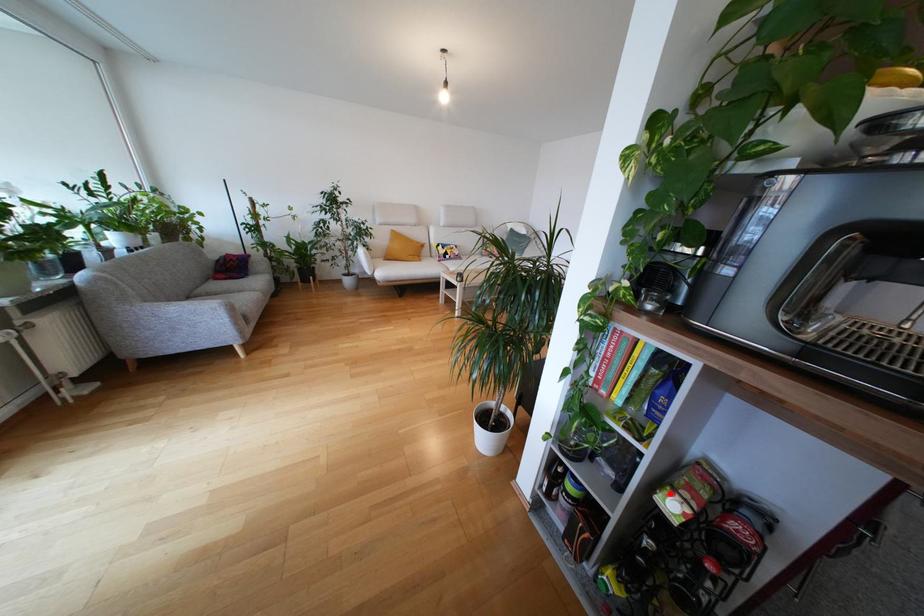
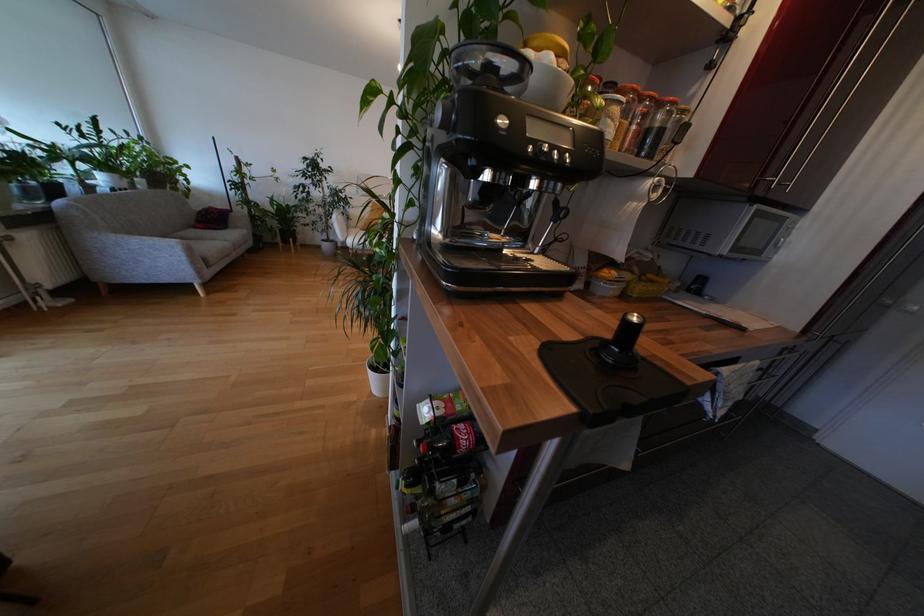
Question: A red point is marked in image1. In image2, is the corresponding 3D point closer to the camera or farther? Reply with the corresponding letter.

Choices:
 (A) The corresponding 3D point is closer.
 (B) The corresponding 3D point is farther.

Answer: (B)